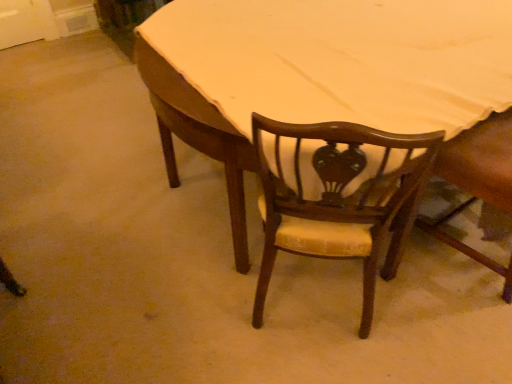
What are the coordinates of `vacant region to the right of wooden chair at center, positioned as the 1th chair in left-to-right order` in the screenshot? It's located at (423, 322).